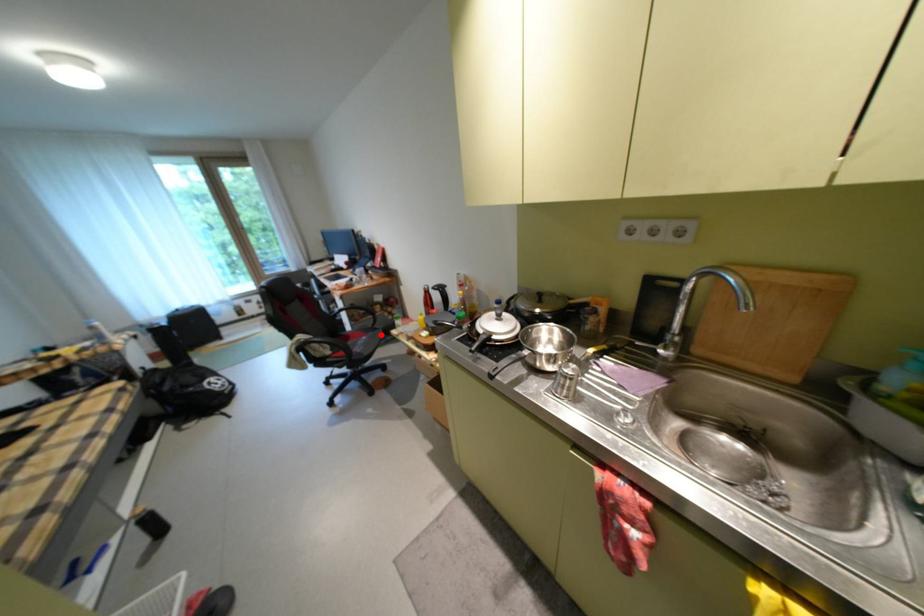
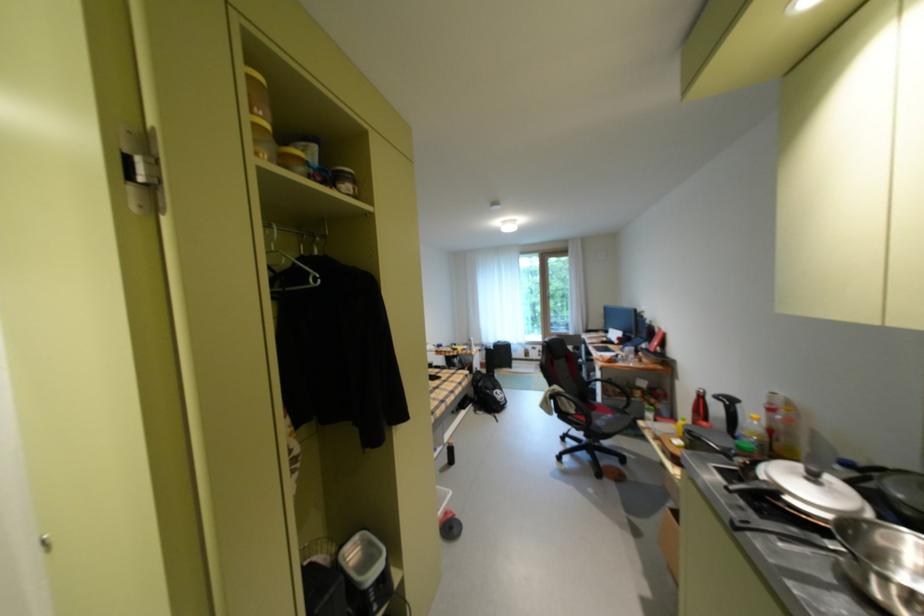
Question: I am providing you with two images of the same scene from different viewpoints. Given a red point in image1, look at the same physical point in image2. Is it:

Choices:
 (A) Closer to the viewpoint
 (B) Farther from the viewpoint

Answer: (A)